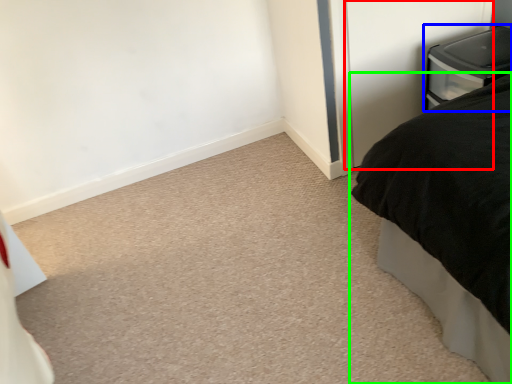
Question: Which is nearer to the screen door (highlighted by a red box)? furniture (highlighted by a blue box) or bed (highlighted by a green box).

Choices:
 (A) furniture
 (B) bed

Answer: (A)